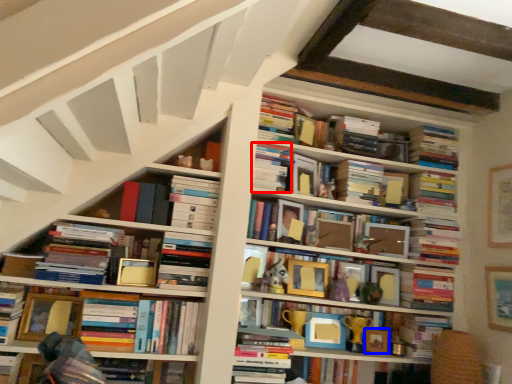
Question: Which object is closer to the camera taking this photo, book (highlighted by a red box) or picture frame (highlighted by a blue box)?

Choices:
 (A) book
 (B) picture frame

Answer: (A)